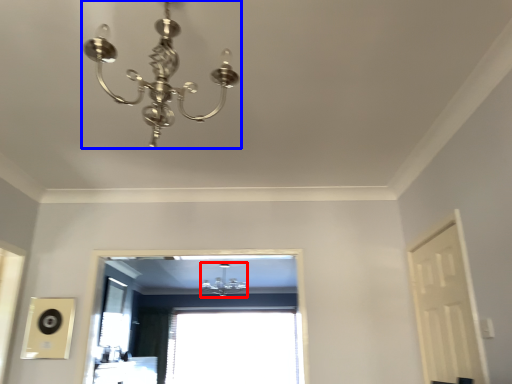
Question: Which object appears farthest to the camera in this image, lamp (highlighted by a red box) or lamp (highlighted by a blue box)?

Choices:
 (A) lamp
 (B) lamp

Answer: (A)